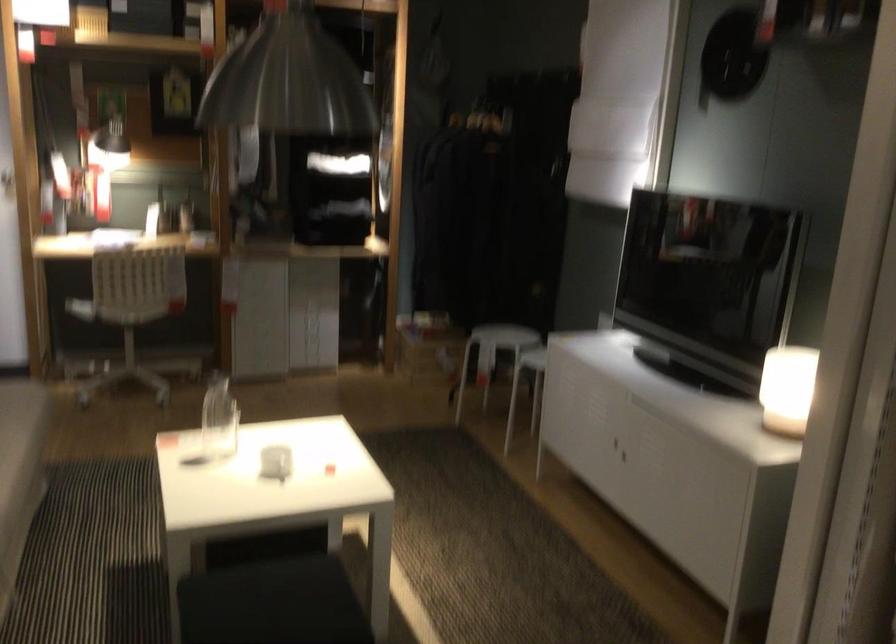
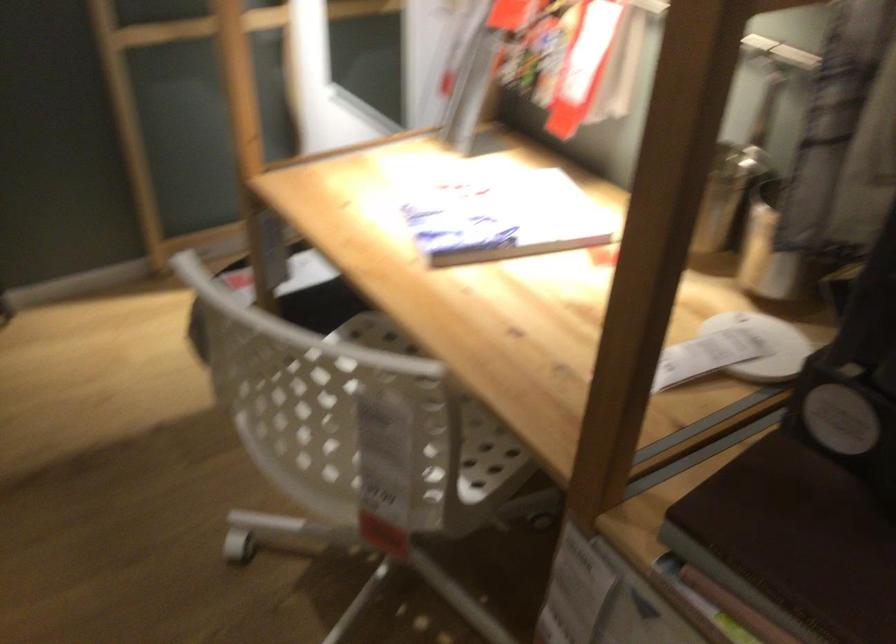
In the second image, find the point that corresponds to point 174,261 in the first image.

(371, 418)